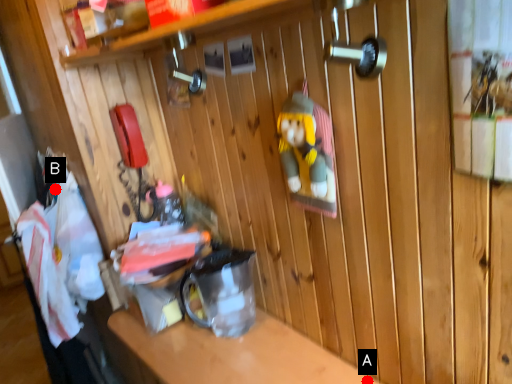
Question: Two points are circled on the image, labeled by A and B beside each circle. Which of the following is the farthest from the observer?

Choices:
 (A) A is further
 (B) B is further

Answer: (B)